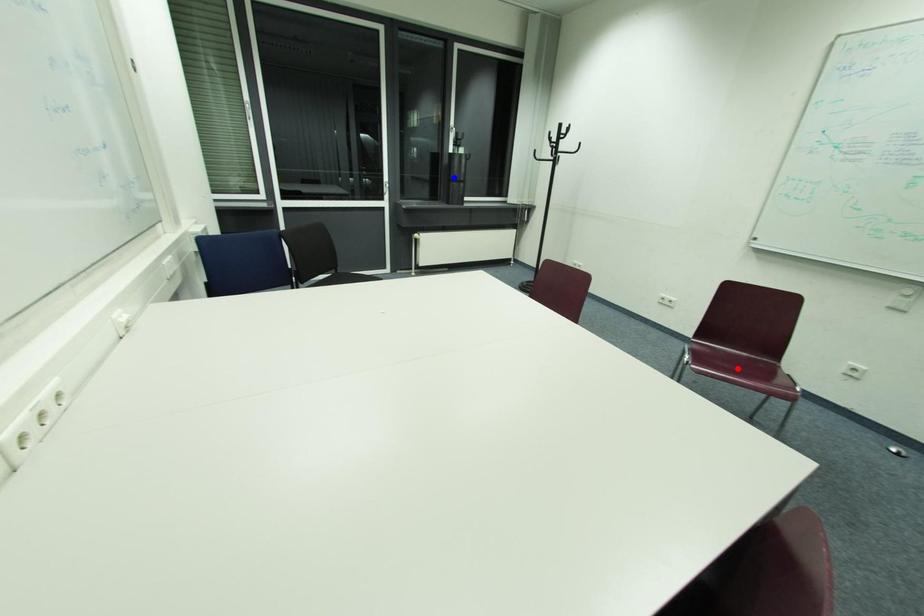
Question: Two points are marked on the image. Which point is closer to the camera?

Choices:
 (A) Blue point is closer.
 (B) Red point is closer.

Answer: (B)